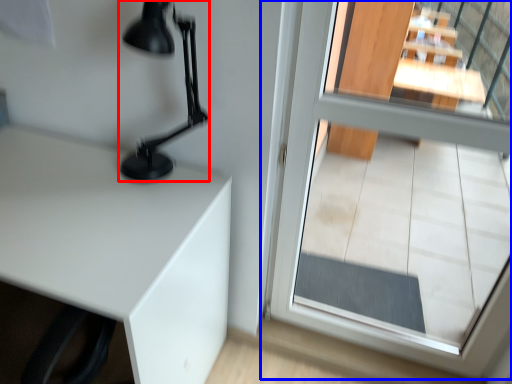
Question: Which point is further to the camera, table lamp (highlighted by a red box) or glass door (highlighted by a blue box)?

Choices:
 (A) table lamp
 (B) glass door

Answer: (A)